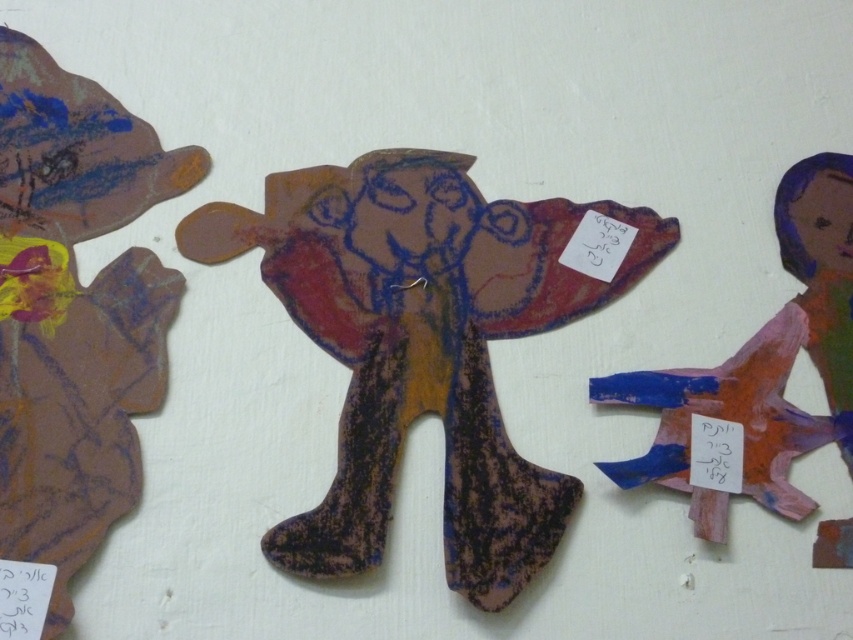
Is point (310, 237) positioned in front of point (780, 236)?

No, it is behind (780, 236).

Can you confirm if matte brown paper doll at center is wider than matte brown paper doll at right?

Correct, the width of matte brown paper doll at center exceeds that of matte brown paper doll at right.

Who is more forward, (430, 330) or (805, 275)?

Point (430, 330)

Identify the location of matte brown paper doll at center. (422, 346).